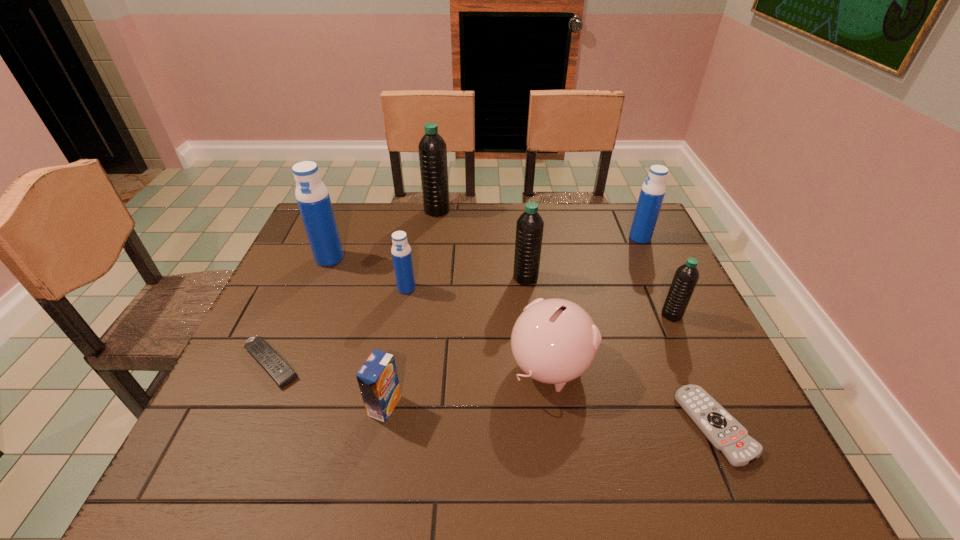
Point out which water bottle is positioned as the fifth nearest to the left remote control. Please provide its 2D coordinates. Your answer should be formatted as a tuple, i.e. [(x, y)], where the tuple contains the x and y coordinates of a point satisfying the conditions above.

[(686, 276)]

Identify which black water bottle is located as the third nearest to the left remote control. Please provide its 2D coordinates. Your answer should be formatted as a tuple, i.e. [(x, y)], where the tuple contains the x and y coordinates of a point satisfying the conditions above.

[(686, 276)]

Locate which black water bottle is the third closest to the orange_juice. Please provide its 2D coordinates. Your answer should be formatted as a tuple, i.e. [(x, y)], where the tuple contains the x and y coordinates of a point satisfying the conditions above.

[(432, 148)]

Locate an element on the screen. Image resolution: width=960 pixels, height=540 pixels. blue water bottle identified as the second closest to the leftmost blue water bottle is located at coordinates (652, 193).

At what (x,y) coordinates should I click in order to perform the action: click on blue water bottle that is the third nearest to the blue orange_juice. Please return your answer as a coordinate pair (x, y). This screenshot has height=540, width=960. Looking at the image, I should click on (652, 193).

Identify the location of blank area in the image that satisfies the following two spatial constraints: 1. on the front side of the pink piggy bank; 2. on the right side of the shorter remote control. The width and height of the screenshot is (960, 540). (559, 426).

Image resolution: width=960 pixels, height=540 pixels. I want to click on blank space that satisfies the following two spatial constraints: 1. on the back side of the nearest black water bottle; 2. on the left side of the second farthest water bottle, so click(x=636, y=238).

Where is `free space that satisfies the following two spatial constraints: 1. on the back side of the biggest black water bottle; 2. on the left side of the nearest blue water bottle`? free space that satisfies the following two spatial constraints: 1. on the back side of the biggest black water bottle; 2. on the left side of the nearest blue water bottle is located at coordinates (421, 211).